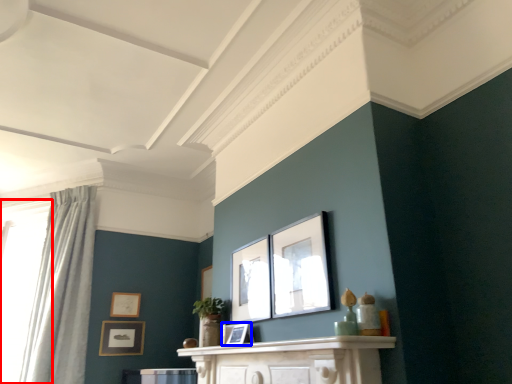
Question: Among these objects, which one is farthest to the camera, window (highlighted by a red box) or picture frame (highlighted by a blue box)?

Choices:
 (A) window
 (B) picture frame

Answer: (A)